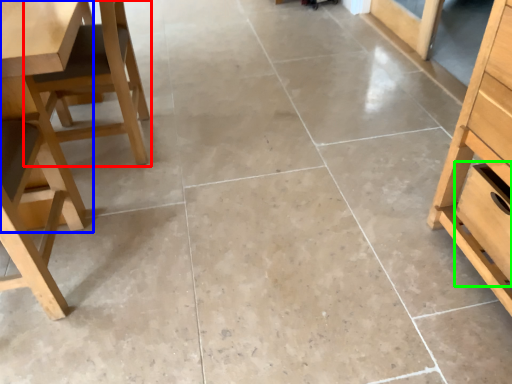
Question: Which object is positioned farthest from chair (highlighted by a red box)? Select from table (highlighted by a blue box) and drawer (highlighted by a green box).

Choices:
 (A) table
 (B) drawer

Answer: (B)